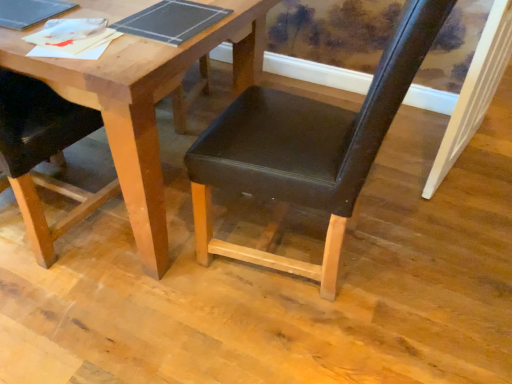
Question: Can you confirm if matte black chair at left, arranged as the 1th chair when viewed from the left, is smaller than wooden table at center?

Choices:
 (A) no
 (B) yes

Answer: (B)

Question: Can you confirm if matte black chair at left, arranged as the 1th chair when viewed from the left, is wider than wooden table at center?

Choices:
 (A) yes
 (B) no

Answer: (B)

Question: Considering the relative sizes of matte black chair at left, the second chair from the right, and wooden table at center in the image provided, is matte black chair at left, the second chair from the right, bigger than wooden table at center?

Choices:
 (A) yes
 (B) no

Answer: (B)

Question: Is matte black chair at left, the second chair from the right, shorter than wooden table at center?

Choices:
 (A) yes
 (B) no

Answer: (B)

Question: Is matte black chair at left, arranged as the 1th chair when viewed from the left, far away from wooden table at center?

Choices:
 (A) yes
 (B) no

Answer: (B)

Question: Is the depth of matte black chair at left, the second chair from the right, greater than that of wooden table at center?

Choices:
 (A) no
 (B) yes

Answer: (A)

Question: Does matte black chair at center, the first chair positioned from the right, have a lesser height compared to white painted wood door frame at right?

Choices:
 (A) yes
 (B) no

Answer: (B)

Question: From a real-world perspective, is matte black chair at center, the first chair positioned from the right, located higher than white painted wood door frame at right?

Choices:
 (A) no
 (B) yes

Answer: (B)

Question: Is the position of matte black chair at center, placed as the second chair when sorted from left to right, more distant than that of white painted wood door frame at right?

Choices:
 (A) yes
 (B) no

Answer: (B)

Question: From the image's perspective, is matte black chair at center, placed as the second chair when sorted from left to right, over white painted wood door frame at right?

Choices:
 (A) yes
 (B) no

Answer: (B)

Question: Is matte black chair at center, placed as the second chair when sorted from left to right, in front of white painted wood door frame at right?

Choices:
 (A) no
 (B) yes

Answer: (B)

Question: From a real-world perspective, is matte black chair at center, the first chair positioned from the right, below white painted wood door frame at right?

Choices:
 (A) yes
 (B) no

Answer: (B)

Question: Is matte black chair at center, placed as the second chair when sorted from left to right, behind matte black chair at left, the second chair from the right?

Choices:
 (A) no
 (B) yes

Answer: (A)